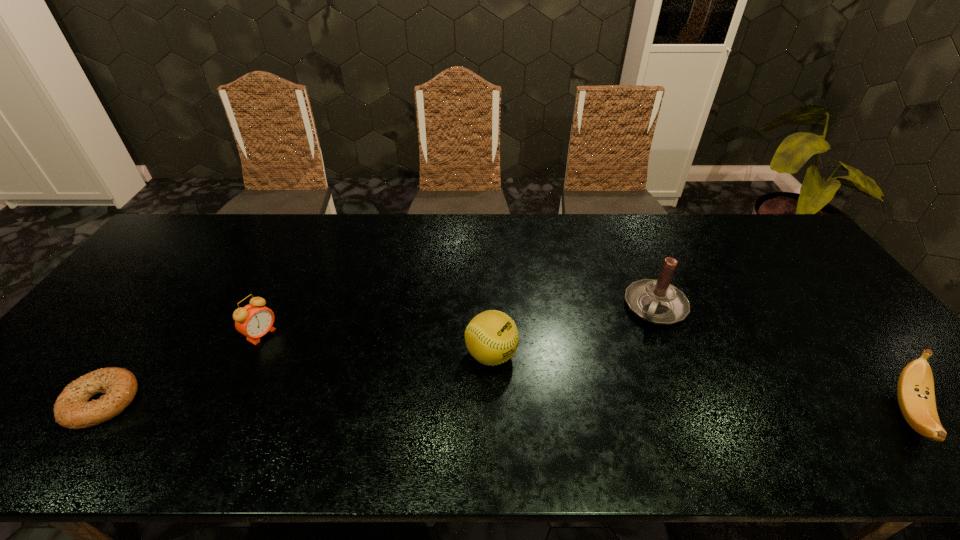
You are a GUI agent. You are given a task and a screenshot of the screen. Output one action in this format:
    pyautogui.click(x=<x>, y=<y>)
    Task: Click on the vacant spot on the desktop that is between the shortest object and the rightmost object and is positioned on the side of the fourth object from left to right with the handle loop
    The height and width of the screenshot is (540, 960).
    Given the screenshot: What is the action you would take?
    point(611,409)

I want to click on free space on the desktop that is between the shortest object and the banana and is positioned on the face of the second object from left to right, so click(381, 406).

Find the location of a particular element. free space on the desktop that is between the leftmost object and the banana and is positioned on the logo side of the third object from right to left is located at coordinates (587, 409).